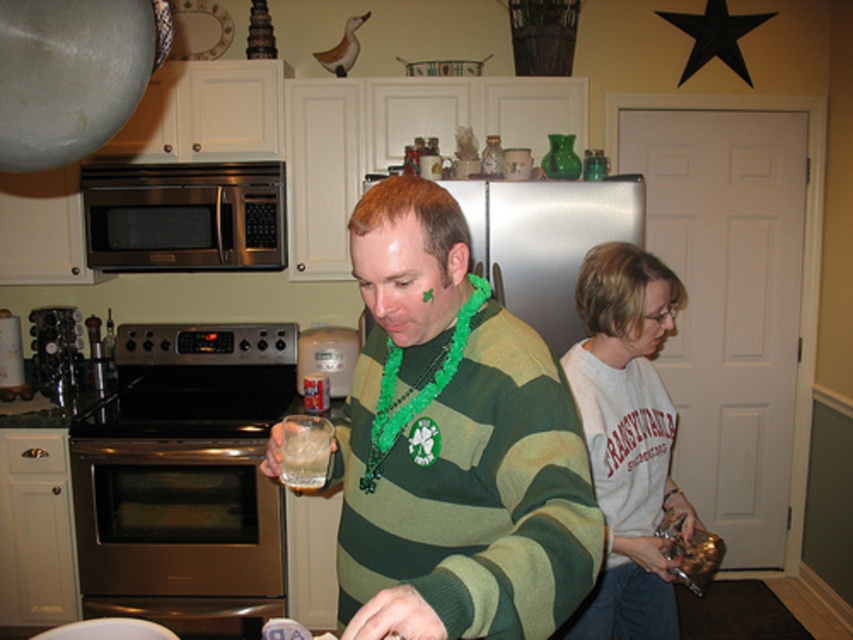
Question: Which point is closer to the camera taking this photo?

Choices:
 (A) (51, 26)
 (B) (314, 440)
 (C) (439, 563)
 (D) (646, 582)

Answer: (A)

Question: Among these objects, which one is nearest to the camera?

Choices:
 (A) white cotton shirt at right
 (B) stainless steel microwave at upper left
 (C) green matte sweater at center

Answer: (C)

Question: Among these points, which one is nearest to the camera?

Choices:
 (A) (1, 132)
 (B) (633, 436)
 (C) (461, 362)
 (D) (283, 460)

Answer: (A)

Question: Can you confirm if green matte sweater at center is thinner than stainless steel microwave at upper left?

Choices:
 (A) no
 (B) yes

Answer: (B)

Question: Is green matte sweater at center behind silver metallic exhaust hood at upper left?

Choices:
 (A) yes
 (B) no

Answer: (B)

Question: Is silver metallic exhaust hood at upper left closer to camera compared to clear glass at center?

Choices:
 (A) yes
 (B) no

Answer: (A)